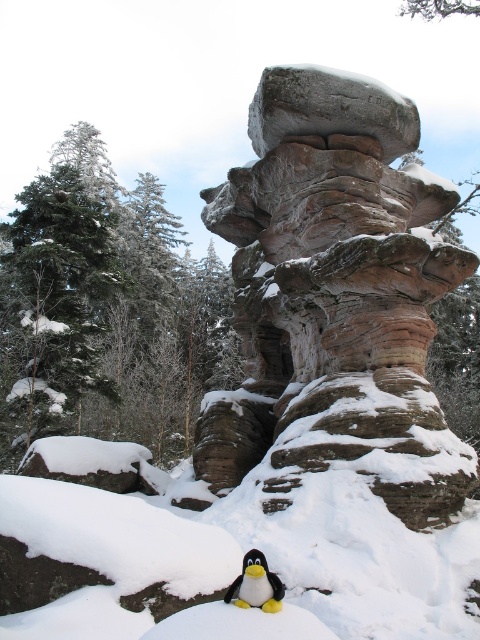
Consider the image. You are a photographer aiming to capture the rustic stone formation at center and the black plush penguin at lower center in a single shot. Based on their positions, which object should you focus on first to ensure both are in frame?

The rustic stone formation at center is located above the black plush penguin at lower center, so you should focus on the black plush penguin at lower center first to ensure both are in frame.

You are a snowplow operator needing to clear a path between the rustic stone formation at center and the black plush penguin at lower center. The maximum distance your snowplow can cover in one trip is 20 meters. Can you clear the path in a single trip without needing to refuel?

The distance between the rustic stone formation at center and the black plush penguin at lower center is 20.27 meters. Since this exceeds the snowplow operator can cover in one trip, which is 20 meters, the path cannot be cleared in a single trip without refueling.

You are standing at the base of the rock formation and want to take a photo of the point at coordinates point (381, 93). If your camera can focus on objects up to 30 meters away, will it be able to capture that point clearly?

The distance of point (381, 93) from camera is 33.86 meters, which is beyond the camera focus limit of 30 meters. The camera cannot capture the point clearly.